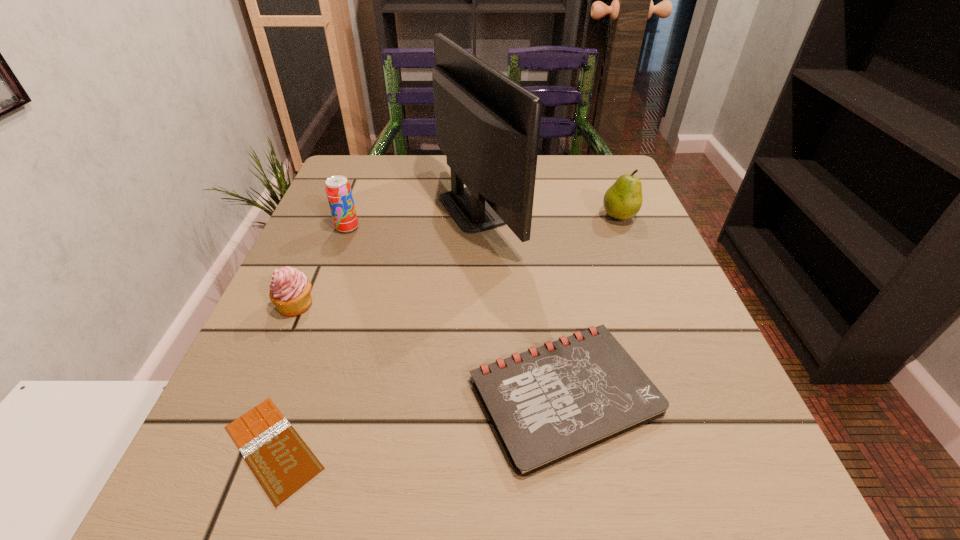
The height and width of the screenshot is (540, 960). Identify the location of notebook that is at the right edge. (549, 403).

Where is `object present at the near left corner`? This screenshot has width=960, height=540. object present at the near left corner is located at coordinates (282, 462).

The width and height of the screenshot is (960, 540). Identify the location of object that is at the near right corner. (549, 403).

This screenshot has width=960, height=540. I want to click on free space at the far edge, so click(x=543, y=178).

The height and width of the screenshot is (540, 960). I want to click on vacant space at the near edge, so click(395, 512).

Locate an element on the screen. free space at the left edge of the desktop is located at coordinates (371, 230).

This screenshot has height=540, width=960. I want to click on free spot at the right edge of the desktop, so click(x=645, y=309).

In the image, there is a desktop. Identify the location of vacant space at the far right corner. Image resolution: width=960 pixels, height=540 pixels. (596, 155).

In order to click on vacant space that's between the computer monitor and the rightmost object in this screenshot , I will do `click(548, 212)`.

Locate an element on the screen. This screenshot has height=540, width=960. blank region between the rightmost object and the computer monitor is located at coordinates (548, 212).